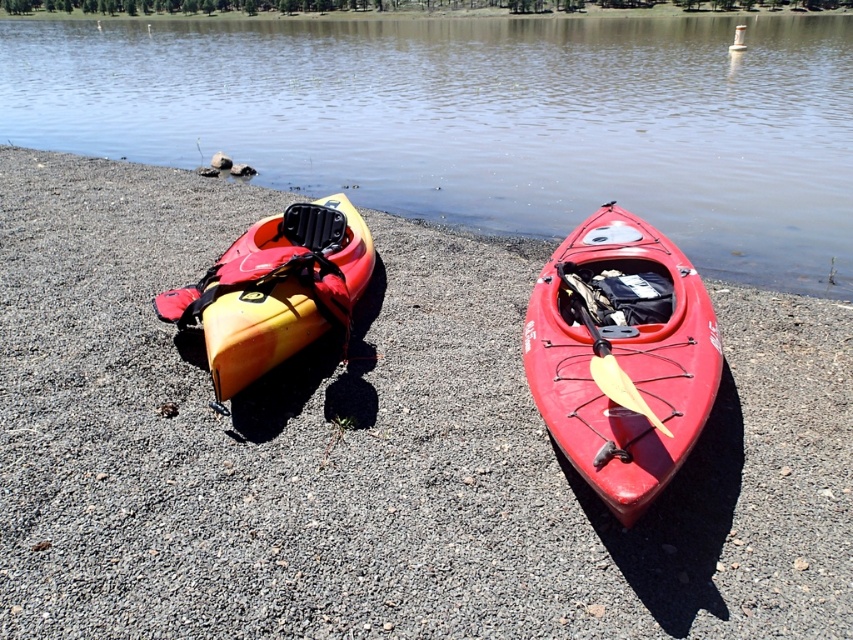
Question: Does transparent water at center have a smaller size compared to matte red kayak at center?

Choices:
 (A) yes
 (B) no

Answer: (B)

Question: Which of these objects is positioned farthest from the matte red kayak at center?

Choices:
 (A) yellow matte kayak at left
 (B) transparent water at center

Answer: (B)

Question: Is transparent water at center in front of yellow matte kayak at left?

Choices:
 (A) no
 (B) yes

Answer: (A)

Question: Which of the following is the closest to the observer?

Choices:
 (A) yellow matte kayak at left
 (B) transparent water at center
 (C) matte red kayak at center

Answer: (C)

Question: Estimate the real-world distances between objects in this image. Which object is closer to the matte red kayak at center?

Choices:
 (A) yellow matte kayak at left
 (B) transparent water at center

Answer: (A)

Question: Does transparent water at center come behind matte red kayak at center?

Choices:
 (A) yes
 (B) no

Answer: (A)